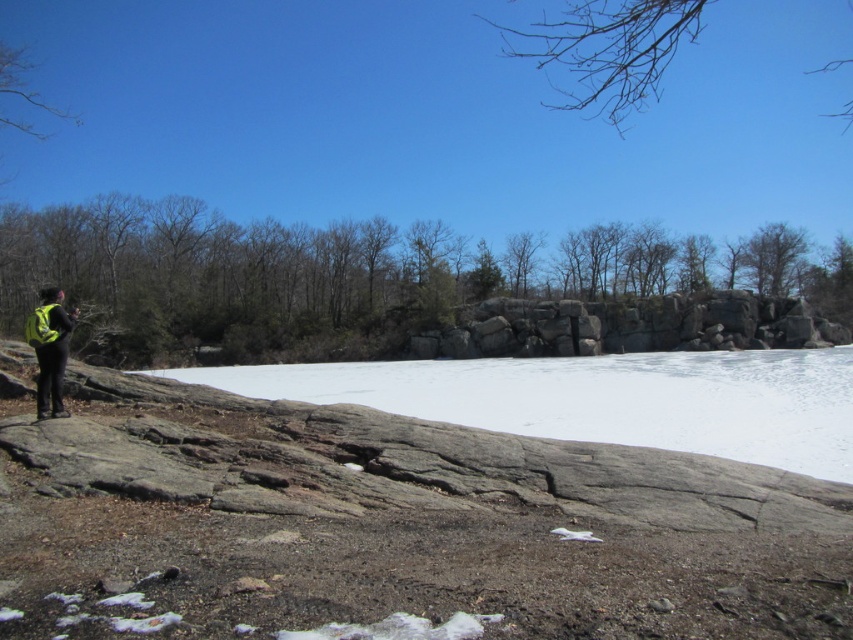
Is point (560, 365) positioned before point (792, 342)?

Yes.

Which is more to the right, white matte snow at center or gray/rocky rock formation at center?

Positioned to the right is gray/rocky rock formation at center.

Who is more forward, (614,413) or (442,333)?

Point (614,413)

Locate an element on the screen. Image resolution: width=853 pixels, height=640 pixels. white matte snow at center is located at coordinates (601, 397).

Can you confirm if white matte snow at center is thinner than neon yellow backpack at left?

Incorrect, white matte snow at center's width is not less than neon yellow backpack at left's.

Which is more to the right, white matte snow at center or neon yellow backpack at left?

white matte snow at center is more to the right.

The image size is (853, 640). What are the coordinates of `white matte snow at center` in the screenshot? It's located at (601, 397).

Locate an element on the screen. white matte snow at center is located at coordinates (601, 397).

Does gray/rocky rock formation at center appear over neon yellow backpack at left?

Actually, gray/rocky rock formation at center is below neon yellow backpack at left.

At what (x,y) coordinates should I click in order to perform the action: click on gray/rocky rock formation at center. Please return your answer as a coordinate pair (x, y). This screenshot has width=853, height=640. Looking at the image, I should click on (631, 326).